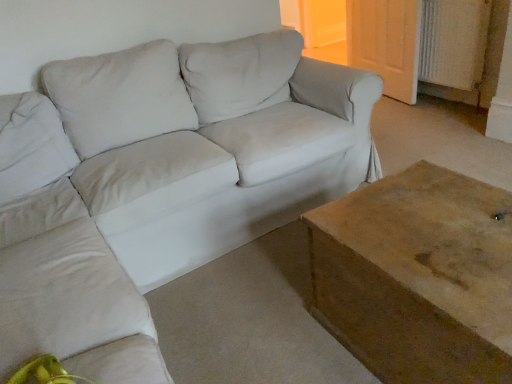
Locate an element on the screen. light beige fabric couch at center is located at coordinates (158, 184).

Does point (334, 201) come behind point (411, 73)?

No, (334, 201) is in front of (411, 73).

Considering the sizes of objects wooden table at lower right and wooden door at upper right in the image provided, who is shorter, wooden table at lower right or wooden door at upper right?

wooden table at lower right.

What's the angular difference between wooden table at lower right and wooden door at upper right's facing directions?

The facing directions of wooden table at lower right and wooden door at upper right are 170 degrees apart.

Between wooden table at lower right and wooden door at upper right, which one has larger size?

Bigger between the two is wooden table at lower right.

Are light beige fabric couch at center and wooden table at lower right far apart?

light beige fabric couch at center is actually quite close to wooden table at lower right.

Based on their positions, is light beige fabric couch at center located to the left or right of wooden table at lower right?

light beige fabric couch at center is positioned on wooden table at lower right's left side.

Which is behind, point (285, 161) or point (423, 227)?

The point (285, 161) is farther.

From a real-world perspective, which is physically above, light beige fabric couch at center or wooden table at lower right?

light beige fabric couch at center is physically above.

Is wooden table at lower right closer to camera compared to light beige fabric couch at center?

Yes, the depth of wooden table at lower right is less than that of light beige fabric couch at center.

From the image's perspective, which one is positioned higher, wooden table at lower right or light beige fabric couch at center?

light beige fabric couch at center, from the image's perspective.

How far apart are wooden table at lower right and light beige fabric couch at center?

A distance of 31.30 inches exists between wooden table at lower right and light beige fabric couch at center.

Is wooden door at upper right spatially inside wooden table at lower right, or outside of it?

wooden door at upper right cannot be found inside wooden table at lower right.

Would you consider wooden door at upper right to be distant from wooden table at lower right?

Indeed, wooden door at upper right is not near wooden table at lower right.

Who is more distant, wooden door at upper right or wooden table at lower right?

wooden door at upper right is further away from the camera.

Consider the image. Between wooden door at upper right and wooden table at lower right, which one appears on the right side from the viewer's perspective?

From the viewer's perspective, wooden door at upper right appears more on the right side.

How distant is light beige fabric couch at center from wooden door at upper right?

light beige fabric couch at center and wooden door at upper right are 5.65 feet apart.

Does light beige fabric couch at center have a larger size compared to wooden door at upper right?

Yes.

Relative to wooden door at upper right, is light beige fabric couch at center in front or behind?

Visually, light beige fabric couch at center is located in front of wooden door at upper right.

Which object is wider, light beige fabric couch at center or wooden door at upper right?

light beige fabric couch at center.

Locate an element on the screen. This screenshot has height=384, width=512. table below the white textured radiator at upper right (from the image's perspective) is located at coordinates (418, 276).

Does white textured radiator at upper right appear on the right side of wooden table at lower right?

Correct, you'll find white textured radiator at upper right to the right of wooden table at lower right.

Is wooden table at lower right at the back of white textured radiator at upper right?

That's not correct — white textured radiator at upper right is not looking away from wooden table at lower right.

From a real-world perspective, is white textured radiator at upper right above or below wooden table at lower right?

white textured radiator at upper right is situated higher than wooden table at lower right in the real world.

You are a GUI agent. You are given a task and a screenshot of the screen. Output one action in this format:
    pyautogui.click(x=<x>, y=<y>)
    Task: Click on the radiator above the wooden table at lower right (from a real-world perspective)
    
    Given the screenshot: What is the action you would take?
    pyautogui.click(x=453, y=42)

From a real-world perspective, which object stands above the other?

From a 3D spatial view, white textured radiator at upper right is above.

Who is bigger, wooden table at lower right or white textured radiator at upper right?

wooden table at lower right is bigger.

Is wooden table at lower right not within white textured radiator at upper right?

Yes, wooden table at lower right is outside of white textured radiator at upper right.

This screenshot has width=512, height=384. Identify the location of table that appears in front of the wooden door at upper right. (418, 276).

Where is `table below the light beige fabric couch at center (from the image's perspective)`? This screenshot has width=512, height=384. table below the light beige fabric couch at center (from the image's perspective) is located at coordinates (418, 276).

Looking at the image, which one is located closer to wooden table at lower right, wooden door at upper right or white textured radiator at upper right?

white textured radiator at upper right lies closer to wooden table at lower right than the other object.

Considering their positions, is white textured radiator at upper right positioned closer to wooden table at lower right than light beige fabric couch at center?

light beige fabric couch at center is closer to wooden table at lower right.

Based on their spatial positions, is wooden door at upper right or white textured radiator at upper right further from light beige fabric couch at center?

wooden door at upper right lies further to light beige fabric couch at center than the other object.

Which object lies nearer to the anchor point wooden table at lower right, white textured radiator at upper right or wooden door at upper right?

white textured radiator at upper right is positioned closer to the anchor wooden table at lower right.

Considering their positions, is white textured radiator at upper right positioned closer to wooden door at upper right than light beige fabric couch at center?

white textured radiator at upper right.

Considering their positions, is wooden door at upper right positioned closer to wooden table at lower right than light beige fabric couch at center?

The object closer to wooden table at lower right is light beige fabric couch at center.

Considering their positions, is light beige fabric couch at center positioned closer to wooden door at upper right than wooden table at lower right?

light beige fabric couch at center is closer to wooden door at upper right.

Looking at this image, estimate the real-world distances between objects in this image. Which object is closer to light beige fabric couch at center, wooden door at upper right or wooden table at lower right?

wooden table at lower right is closer to light beige fabric couch at center.

Where is `radiator located between wooden table at lower right and wooden door at upper right in the depth direction`? radiator located between wooden table at lower right and wooden door at upper right in the depth direction is located at coordinates (453, 42).

Where is `radiator positioned between light beige fabric couch at center and wooden door at upper right from near to far`? The image size is (512, 384). radiator positioned between light beige fabric couch at center and wooden door at upper right from near to far is located at coordinates (453, 42).

You are a GUI agent. You are given a task and a screenshot of the screen. Output one action in this format:
    pyautogui.click(x=<x>, y=<y>)
    Task: Click on the studio couch positioned between wooden table at lower right and white textured radiator at upper right from near to far
    The image size is (512, 384).
    Given the screenshot: What is the action you would take?
    pyautogui.click(x=158, y=184)

At what (x,y) coordinates should I click in order to perform the action: click on studio couch between wooden table at lower right and wooden door at upper right from front to back. Please return your answer as a coordinate pair (x, y). Looking at the image, I should click on (158, 184).